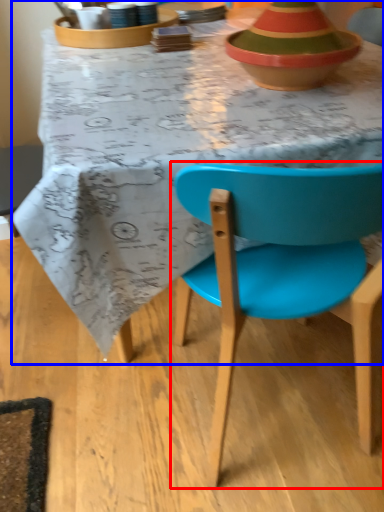
Question: Among these objects, which one is nearest to the camera, chair (highlighted by a red box) or desk (highlighted by a blue box)?

Choices:
 (A) chair
 (B) desk

Answer: (A)